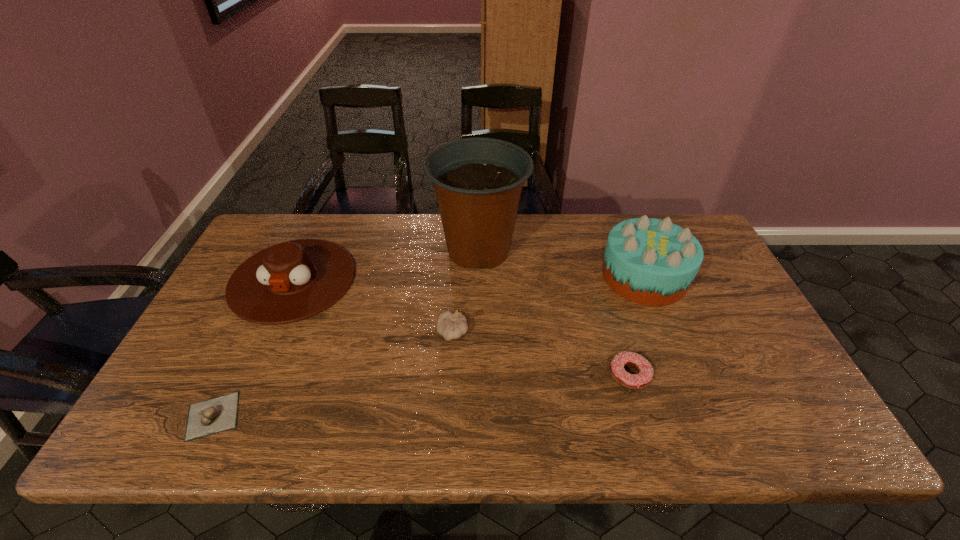
This screenshot has width=960, height=540. I want to click on vacant point located between the nearer garlic and the right garlic, so click(x=333, y=375).

This screenshot has width=960, height=540. Identify the location of free point between the shorter garlic and the farther garlic. (333, 375).

At what (x,y) coordinates should I click in order to perform the action: click on empty space that is in between the flowerpot and the cowboy hat. Please return your answer as a coordinate pair (x, y). The width and height of the screenshot is (960, 540). Looking at the image, I should click on (386, 265).

Where is `unoccupied position between the second shortest object and the fifth shortest object`? The width and height of the screenshot is (960, 540). unoccupied position between the second shortest object and the fifth shortest object is located at coordinates 637,326.

Identify the location of vacant region between the shortest object and the right garlic. The image size is (960, 540). (333, 375).

The image size is (960, 540). I want to click on empty location between the cowboy hat and the cake, so click(x=468, y=278).

Where is `free space between the left garlic and the doughnut`? This screenshot has height=540, width=960. free space between the left garlic and the doughnut is located at coordinates (421, 396).

At what (x,y) coordinates should I click in order to perform the action: click on vacant point located between the left garlic and the second tallest object. Please return your answer as a coordinate pair (x, y). The image size is (960, 540). Looking at the image, I should click on (428, 346).

Where is `object identified as the third closest to the fifth tallest object`? The width and height of the screenshot is (960, 540). object identified as the third closest to the fifth tallest object is located at coordinates (451, 326).

Locate an element on the screen. The image size is (960, 540). object that is the fourth nearest to the left garlic is located at coordinates (641, 380).